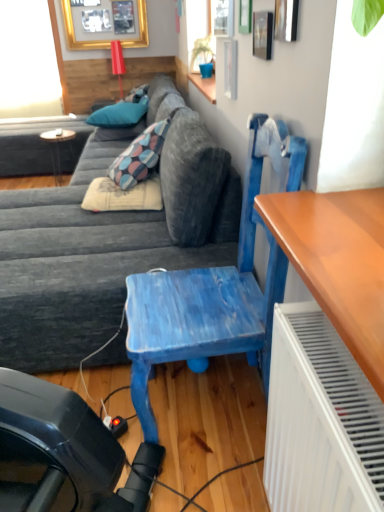
What do you see at coordinates (202, 52) in the screenshot? I see `green matte plant at upper center` at bounding box center [202, 52].

What do you see at coordinates (120, 114) in the screenshot? I see `teal fabric pillow at upper center, positioned as the 3th pillow in bottom-to-top order` at bounding box center [120, 114].

What is the approximate height of blue painted wood chair at center?

The height of blue painted wood chair at center is 3.29 feet.

Describe the element at coordinates (28, 61) in the screenshot. I see `transparent glass window screen at upper left` at that location.

Image resolution: width=384 pixels, height=512 pixels. I want to click on green matte plant at upper center, so click(202, 52).

Which is closer to the camera, (216, 23) or (139, 127)?

Positioned in front is point (216, 23).

How many degrees apart are the facing directions of clear glass window at upper center and teal fabric pillow at upper center, which appears as the first pillow when viewed from the back?

They differ by 81.2 degrees in their facing directions.

Does clear glass window at upper center contain teal fabric pillow at upper center, which is the third pillow from front to back?

No.

Is clear glass window at upper center thinner than teal fabric pillow at upper center, marked as the second pillow in a bottom-to-top arrangement?

Yes.

Visually, is transparent glass window screen at upper left positioned to the left or to the right of teal fabric pillow at upper center, the 2th pillow positioned from the front?

transparent glass window screen at upper left is to the left of teal fabric pillow at upper center, the 2th pillow positioned from the front.

Considering the relative sizes of transparent glass window screen at upper left and teal fabric pillow at upper center, the second pillow positioned from the back, in the image provided, is transparent glass window screen at upper left bigger than teal fabric pillow at upper center, the second pillow positioned from the back,?

Yes, transparent glass window screen at upper left is bigger than teal fabric pillow at upper center, the second pillow positioned from the back.

From the image's perspective, which object appears higher, transparent glass window screen at upper left or teal fabric pillow at upper center, arranged as the 1th pillow when viewed from the top?

transparent glass window screen at upper left.

Would you consider transparent glass window screen at upper left to be distant from teal fabric pillow at upper center, positioned as the 3th pillow in bottom-to-top order?

Yes, transparent glass window screen at upper left and teal fabric pillow at upper center, positioned as the 3th pillow in bottom-to-top order, are quite far apart.

Considering the sizes of objects textured gray couch at center and transparent glass window screen at upper left in the image provided, who is thinner, textured gray couch at center or transparent glass window screen at upper left?

transparent glass window screen at upper left is thinner.

Is textured gray couch at center aimed at transparent glass window screen at upper left?

No, textured gray couch at center is not turned towards transparent glass window screen at upper left.

Can you confirm if textured gray couch at center is positioned to the right of transparent glass window screen at upper left?

Correct, you'll find textured gray couch at center to the right of transparent glass window screen at upper left.

Is textured gray couch at center inside the boundaries of transparent glass window screen at upper left, or outside?

textured gray couch at center cannot be found inside transparent glass window screen at upper left.

What's the angular difference between teal fabric pillow at upper center, the second pillow positioned from the back, and beige fabric pillow at center, marked as the 1th pillow in a bottom-to-top arrangement,'s facing directions?

They differ by 79.3 degrees in their facing directions.

Is teal fabric pillow at upper center, the 2th pillow positioned from the front, behind beige fabric pillow at center, placed as the third pillow when sorted from back to front?

Yes, it is behind beige fabric pillow at center, placed as the third pillow when sorted from back to front.

Is teal fabric pillow at upper center, the 2th pillow positioned from the front, situated inside beige fabric pillow at center, which appears as the third pillow when viewed from the top, or outside?

teal fabric pillow at upper center, the 2th pillow positioned from the front, is not enclosed by beige fabric pillow at center, which appears as the third pillow when viewed from the top.

Between teal fabric pillow at upper center, arranged as the 1th pillow when viewed from the top, and beige fabric pillow at center, which appears as the third pillow when viewed from the top, which one has larger size?

Bigger between the two is teal fabric pillow at upper center, arranged as the 1th pillow when viewed from the top.

Which object is further away from the camera, teal fabric pillow at upper center, which appears as the first pillow when viewed from the back, or green matte plant at upper center?

teal fabric pillow at upper center, which appears as the first pillow when viewed from the back, is further away from the camera.

Which object is positioned more to the left, teal fabric pillow at upper center, which is the third pillow from front to back, or green matte plant at upper center?

Positioned to the left is teal fabric pillow at upper center, which is the third pillow from front to back.

Is teal fabric pillow at upper center, marked as the second pillow in a bottom-to-top arrangement, next to green matte plant at upper center?

They are not placed beside each other.

Does point (125, 136) lie in front of point (202, 53)?

No, it is not.

Choose the correct answer: Is gold framed picture at upper left inside textured gray couch at center or outside it?

gold framed picture at upper left lies outside textured gray couch at center.

Is the depth of gold framed picture at upper left less than that of textured gray couch at center?

No, gold framed picture at upper left is behind textured gray couch at center.

Is gold framed picture at upper left looking in the opposite direction of textured gray couch at center?

That's not correct — gold framed picture at upper left is not looking away from textured gray couch at center.

Is gold framed picture at upper left bigger than textured gray couch at center?

No, gold framed picture at upper left is not bigger than textured gray couch at center.

From the image's perspective, between clear glass window at upper center and blue painted wood chair at center, who is located below?

blue painted wood chair at center appears lower in the image.

Between clear glass window at upper center and blue painted wood chair at center, which one has smaller width?

With smaller width is clear glass window at upper center.

Does clear glass window at upper center have a smaller size compared to blue painted wood chair at center?

Correct, clear glass window at upper center occupies less space than blue painted wood chair at center.

Considering the points (220, 1) and (170, 289), which point is behind, point (220, 1) or point (170, 289)?

The point (220, 1) is farther.

I want to click on the 1st pillow below when counting from the clear glass window at upper center (from the image's perspective), so click(x=119, y=132).

Where is `the 1st pillow to the right of the transparent glass window screen at upper left, starting your count from the anchor`? the 1st pillow to the right of the transparent glass window screen at upper left, starting your count from the anchor is located at coordinates (120, 114).

From the image, which object appears to be nearer to teal fabric pillow at upper center, marked as the second pillow in a bottom-to-top arrangement, beige fabric pillow at center, which appears as the third pillow when viewed from the top, or blue painted wood chair at center?

The object closer to teal fabric pillow at upper center, marked as the second pillow in a bottom-to-top arrangement, is beige fabric pillow at center, which appears as the third pillow when viewed from the top.

In the scene shown: From the image, which object appears to be farther from textured gray couch at center, beige fabric pillow at center, marked as the 1th pillow in a bottom-to-top arrangement, or clear glass window at upper center?

Based on the image, clear glass window at upper center appears to be further to textured gray couch at center.

In the scene shown: From the image, which object appears to be nearer to gold framed picture at upper left, beige fabric pillow at center, positioned as the first pillow in front-to-back order, or blue painted wood chair at center?

beige fabric pillow at center, positioned as the first pillow in front-to-back order, lies closer to gold framed picture at upper left than the other object.

From the image, which object appears to be farther from green matte plant at upper center, beige fabric pillow at center, which appears as the third pillow when viewed from the top, or teal fabric pillow at upper center, the second pillow viewed from the top?

Based on the image, beige fabric pillow at center, which appears as the third pillow when viewed from the top, appears to be further to green matte plant at upper center.

Which object lies further to the anchor point textured gray couch at center, gold framed picture at upper left or green matte plant at upper center?

gold framed picture at upper left.

Looking at the image, which one is located closer to beige fabric pillow at center, which appears as the third pillow when viewed from the top, teal fabric pillow at upper center, positioned as the 3th pillow in bottom-to-top order, or gold framed picture at upper left?

Based on the image, teal fabric pillow at upper center, positioned as the 3th pillow in bottom-to-top order, appears to be nearer to beige fabric pillow at center, which appears as the third pillow when viewed from the top.

When comparing their distances from green matte plant at upper center, does clear glass window at upper center or blue painted wood chair at center seem closer?

Based on the image, clear glass window at upper center appears to be nearer to green matte plant at upper center.

Estimate the real-world distances between objects in this image. Which object is further from transparent glass window screen at upper left, clear glass window at upper center or beige fabric pillow at center, which appears as the third pillow when viewed from the top?

Among the two, clear glass window at upper center is located further to transparent glass window screen at upper left.

What are the coordinates of `table located between clear glass window at upper center and teal fabric pillow at upper center, marked as the second pillow in a bottom-to-top arrangement, in the depth direction` in the screenshot? It's located at (57, 148).

Locate an element on the screen. The width and height of the screenshot is (384, 512). plant between clear glass window at upper center and gold framed picture at upper left in the front-back direction is located at coordinates (202, 52).

At what (x,y) coordinates should I click in order to perform the action: click on plant positioned between textured gray couch at center and transparent glass window screen at upper left from near to far. Please return your answer as a coordinate pair (x, y). The image size is (384, 512). Looking at the image, I should click on (202, 52).

This screenshot has width=384, height=512. What are the coordinates of `table between beige fabric pillow at center, positioned as the first pillow in front-to-back order, and teal fabric pillow at upper center, which appears as the first pillow when viewed from the back, in the front-back direction` in the screenshot? It's located at (57, 148).